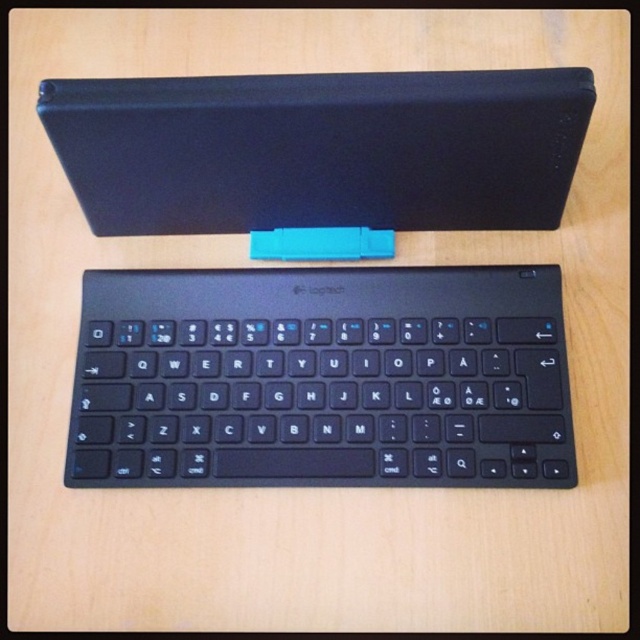
Question: Which object appears closest to the camera in this image?

Choices:
 (A) black matte laptop at upper center
 (B) black matte keyboard at center

Answer: (A)

Question: Is black matte keyboard at center behind black matte laptop at upper center?

Choices:
 (A) no
 (B) yes

Answer: (B)

Question: Does black matte keyboard at center have a smaller size compared to black matte laptop at upper center?

Choices:
 (A) no
 (B) yes

Answer: (B)

Question: Can you confirm if black matte keyboard at center is positioned above black matte laptop at upper center?

Choices:
 (A) yes
 (B) no

Answer: (B)